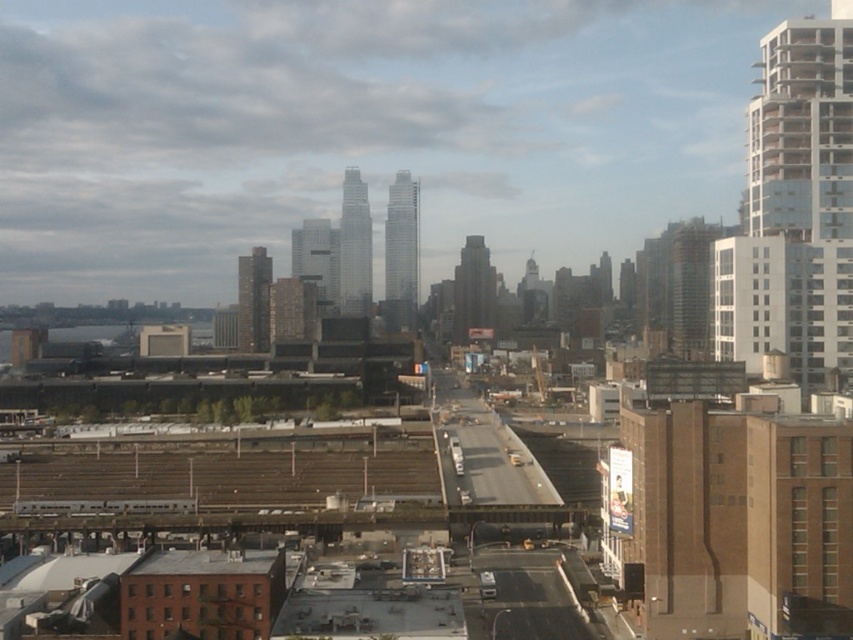
You are standing at the train station and see two points marked on the ground. The first is at point (347, 285) and the second is at point (457, 332). Which point is closer to you?

Point (347, 285) is closer to you because it is further to the viewer than point (457, 332).

You are a city planner reviewing the urban layout. You need to determine the spatial relationship between the dark gray concrete skyscraper at center and the brown brick building at center. Which one is positioned to the right when viewed from the same perspective as the image?

The dark gray concrete skyscraper at center is positioned to the right of the brown brick building at center.

You are an urban planner assessing the cityscape. You need to determine which of the two skyscrapers, the glassy steel skyscraper at center or the dark gray concrete skyscraper at center, has a larger footprint. Based on the scene, which one would you choose?

The glassy steel skyscraper at center is bigger than the dark gray concrete skyscraper at center, so it likely has a larger footprint.